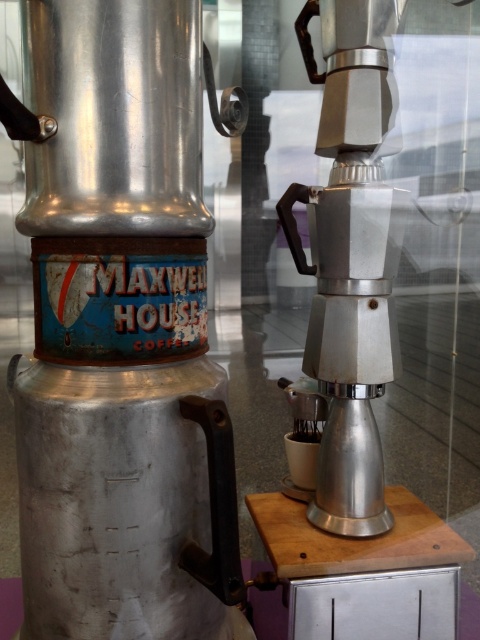
You are standing in front of the two coffee makers. There is a point labeled at coordinates (121,333). Which object does this point belong to?

The point labeled at coordinates (121,333) is on the shiny metallic coffee maker at center.

You are a museum curator arranging an exhibit. You need to ensure that visitors can see both the shiny metallic coffee maker at center and the satin silver coffee machine at center clearly. Based on their positions, which one is closer to the front of the display area?

The shiny metallic coffee maker at center is in front of the satin silver coffee machine at center, so it is closer to the front of the display area.

You are a museum visitor standing in front of two coffee machines. You notice the shiny metallic coffee maker at center and the satin silver coffee machine at center. Which one is positioned to the left?

The shiny metallic coffee maker at center is positioned to the left of the satin silver coffee machine at center.